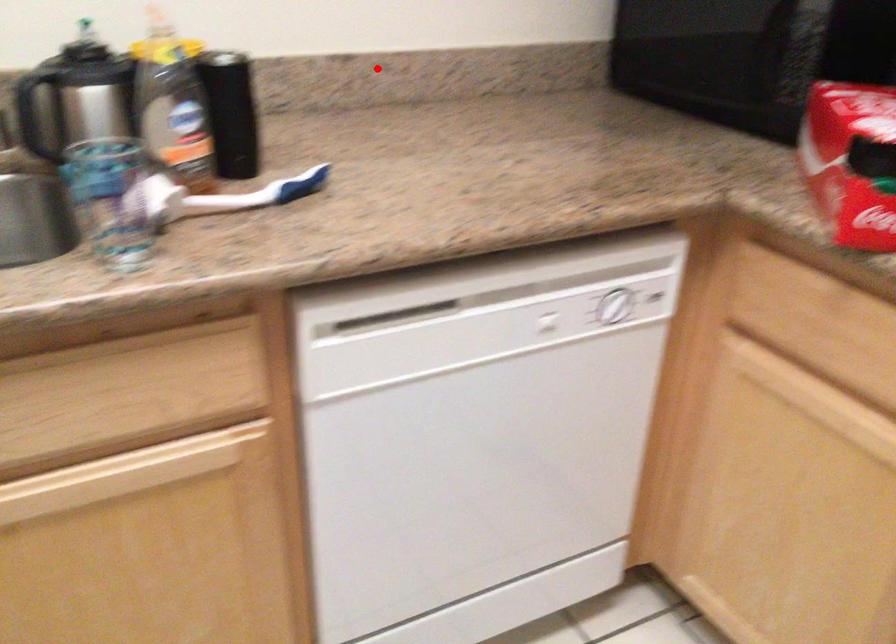
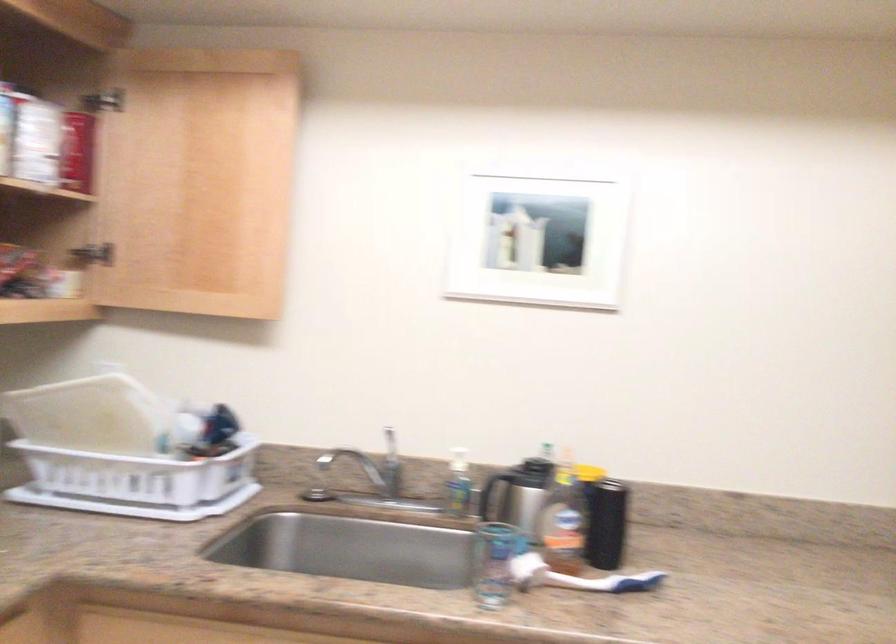
Find the pixel in the second image that matches the highlighted location in the first image.

(765, 506)